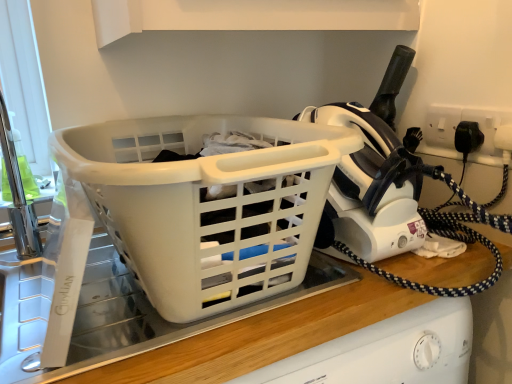
Question: From a real-world perspective, is white plastic socket at upper right under white plastic iron at upper right?

Choices:
 (A) yes
 (B) no

Answer: (A)

Question: Are white plastic socket at upper right and white plastic iron at upper right beside each other?

Choices:
 (A) yes
 (B) no

Answer: (B)

Question: Does white plastic socket at upper right appear on the right side of white plastic iron at upper right?

Choices:
 (A) yes
 (B) no

Answer: (A)

Question: Can you confirm if white plastic socket at upper right is taller than white plastic iron at upper right?

Choices:
 (A) no
 (B) yes

Answer: (A)

Question: Is white plastic socket at upper right bigger than white plastic iron at upper right?

Choices:
 (A) no
 (B) yes

Answer: (A)

Question: From the image's perspective, is white plastic iron at upper right above or below white plastic basket at center?

Choices:
 (A) below
 (B) above

Answer: (B)

Question: Is white plastic iron at upper right to the left or to the right of white plastic basket at center in the image?

Choices:
 (A) right
 (B) left

Answer: (A)

Question: Is white plastic iron at upper right inside the boundaries of white plastic basket at center, or outside?

Choices:
 (A) outside
 (B) inside

Answer: (A)

Question: Considering the positions of point (378, 211) and point (259, 163), is point (378, 211) closer or farther from the camera than point (259, 163)?

Choices:
 (A) farther
 (B) closer

Answer: (A)

Question: Is white plastic basket at center wider or thinner than white plastic iron at upper right?

Choices:
 (A) wide
 (B) thin

Answer: (A)

Question: Is white plastic basket at center in front of or behind white plastic iron at upper right in the image?

Choices:
 (A) behind
 (B) front

Answer: (B)

Question: Based on their sizes in the image, would you say white plastic basket at center is bigger or smaller than white plastic iron at upper right?

Choices:
 (A) small
 (B) big

Answer: (B)

Question: Based on their positions, is white plastic basket at center located to the left or right of white plastic iron at upper right?

Choices:
 (A) right
 (B) left

Answer: (B)

Question: From the image's perspective, is white plastic basket at center above or below white plastic socket at upper right?

Choices:
 (A) below
 (B) above

Answer: (A)

Question: Which is correct: white plastic basket at center is inside white plastic socket at upper right, or outside of it?

Choices:
 (A) inside
 (B) outside

Answer: (B)